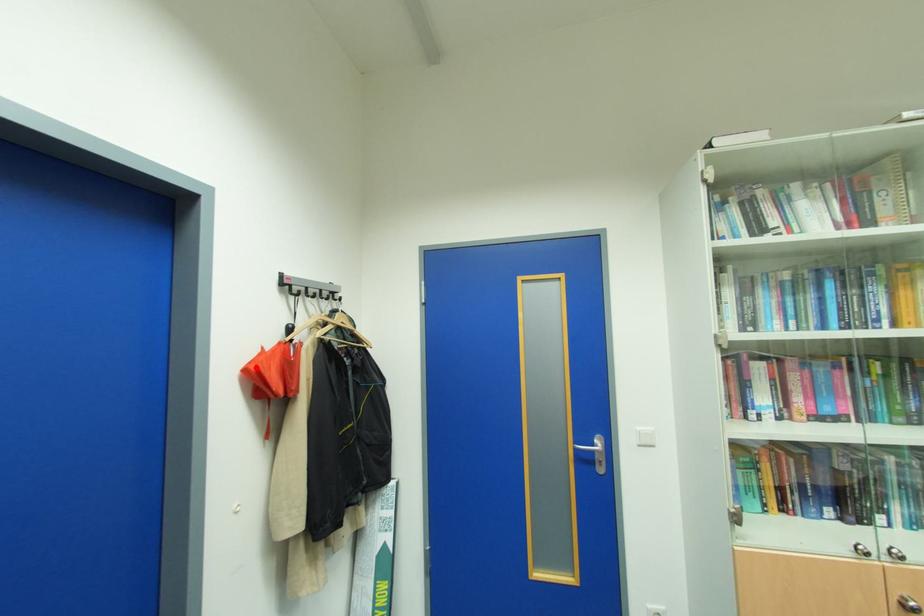
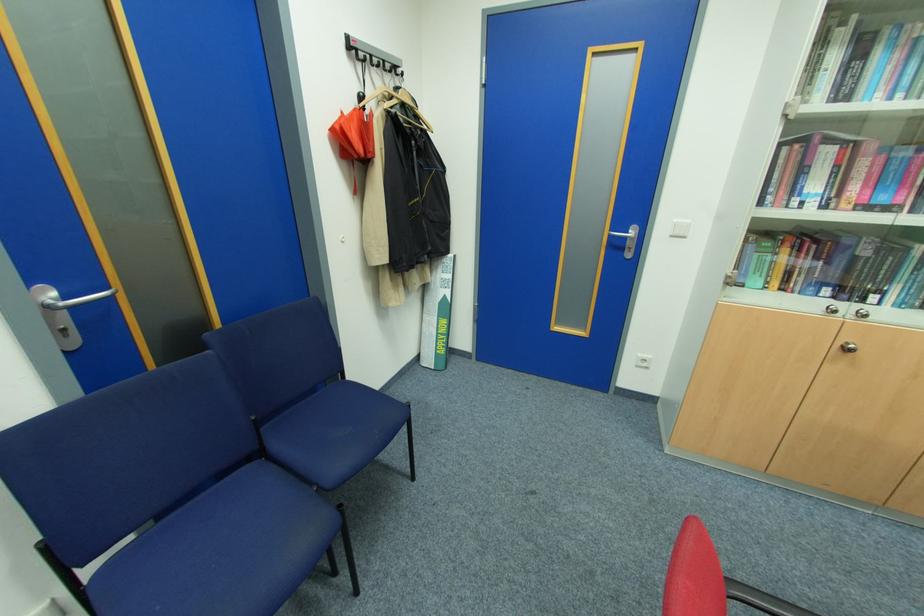
The point at the highlighted location is marked in the first image. Where is the corresponding point in the second image?

(341, 127)